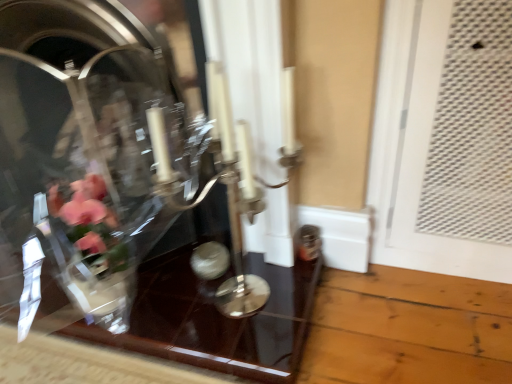
Question: Does transparent glass table at center appear on the left side of silver metallic candle holder at center?

Choices:
 (A) no
 (B) yes

Answer: (B)

Question: Can you confirm if transparent glass table at center is bigger than silver metallic candle holder at center?

Choices:
 (A) no
 (B) yes

Answer: (A)

Question: Considering the relative sizes of transparent glass table at center and silver metallic candle holder at center in the image provided, is transparent glass table at center shorter than silver metallic candle holder at center?

Choices:
 (A) no
 (B) yes

Answer: (B)

Question: Considering the relative sizes of transparent glass table at center and silver metallic candle holder at center in the image provided, is transparent glass table at center wider than silver metallic candle holder at center?

Choices:
 (A) no
 (B) yes

Answer: (B)

Question: Is transparent glass table at center placed right next to silver metallic candle holder at center?

Choices:
 (A) no
 (B) yes

Answer: (A)

Question: Is transparent glass table at center in front of or behind clear glass vase at center in the image?

Choices:
 (A) behind
 (B) front

Answer: (A)

Question: Is transparent glass table at center to the left or to the right of clear glass vase at center in the image?

Choices:
 (A) right
 (B) left

Answer: (A)

Question: From a real-world perspective, is transparent glass table at center above or below clear glass vase at center?

Choices:
 (A) above
 (B) below

Answer: (B)

Question: Based on their sizes in the image, would you say transparent glass table at center is bigger or smaller than clear glass vase at center?

Choices:
 (A) big
 (B) small

Answer: (B)

Question: Do you think transparent glass table at center is within silver metallic candle holder at center, or outside of it?

Choices:
 (A) inside
 (B) outside

Answer: (B)

Question: Relative to silver metallic candle holder at center, is transparent glass table at center in front or behind?

Choices:
 (A) behind
 (B) front

Answer: (A)

Question: Considering the positions of transparent glass table at center and silver metallic candle holder at center in the image, is transparent glass table at center wider or thinner than silver metallic candle holder at center?

Choices:
 (A) thin
 (B) wide

Answer: (B)

Question: Is point (175, 304) positioned closer to the camera than point (236, 187)?

Choices:
 (A) farther
 (B) closer

Answer: (A)

Question: Considering the relative positions of silver metallic candle holder at center and clear glass vase at center in the image provided, is silver metallic candle holder at center to the left or to the right of clear glass vase at center?

Choices:
 (A) right
 (B) left

Answer: (A)

Question: In terms of height, does silver metallic candle holder at center look taller or shorter compared to clear glass vase at center?

Choices:
 (A) short
 (B) tall

Answer: (A)